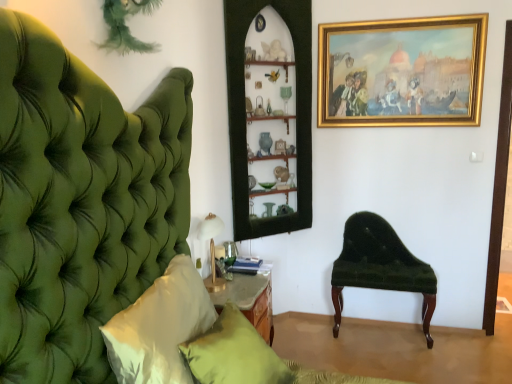
You are a GUI agent. You are given a task and a screenshot of the screen. Output one action in this format:
    pyautogui.click(x=<x>, y=<y>)
    Task: Click on the free space in front of velvet green bench at right
    
    Given the screenshot: What is the action you would take?
    pyautogui.click(x=400, y=360)